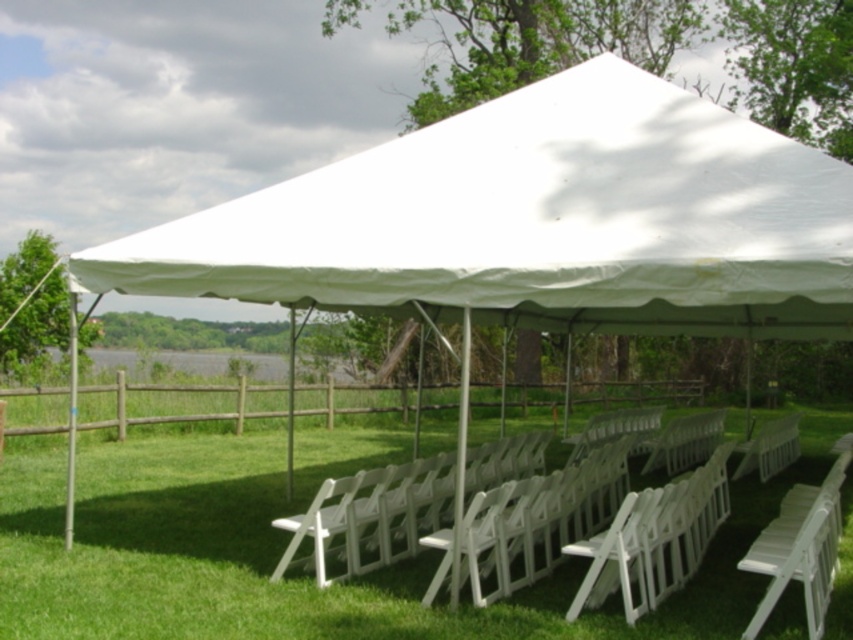
You are planning to set up a small table between the white plastic chairs at center and the white plastic chair at center. Which object should the table be placed closer to if it needs to be positioned at the same height level as the shorter one?

The table should be placed closer to the white plastic chair at center since it is shorter than the white plastic chairs at center, ensuring the table is at the same height level.